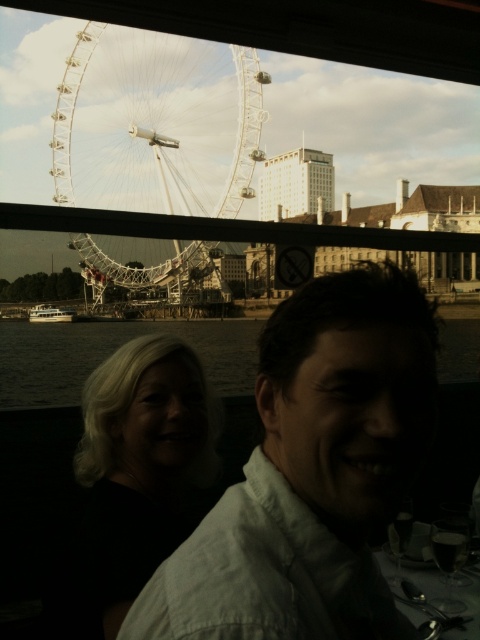
What do you see at coordinates (133, 477) in the screenshot? The width and height of the screenshot is (480, 640). I see `dark hair at lower left` at bounding box center [133, 477].

Who is positioned more to the right, dark hair at lower left or white glossy boat at lower left?

dark hair at lower left

Between point (92, 516) and point (49, 307), which one is positioned in front?

Point (92, 516) is more forward.

Identify the location of dark hair at lower left. (133, 477).

Can you confirm if dark hair at lower left is positioned to the left of dark water at lower left?

Indeed, dark hair at lower left is positioned on the left side of dark water at lower left.

Is point (85, 618) behind point (78, 368)?

That is False.

Image resolution: width=480 pixels, height=640 pixels. I want to click on dark hair at lower left, so click(133, 477).

Can you confirm if white metallic ferris wheel at upper left is positioned to the right of dark water at lower left?

In fact, white metallic ferris wheel at upper left is to the left of dark water at lower left.

Locate an element on the screen. The width and height of the screenshot is (480, 640). white metallic ferris wheel at upper left is located at coordinates (156, 124).

Find the location of a particular element. The width and height of the screenshot is (480, 640). white metallic ferris wheel at upper left is located at coordinates (156, 124).